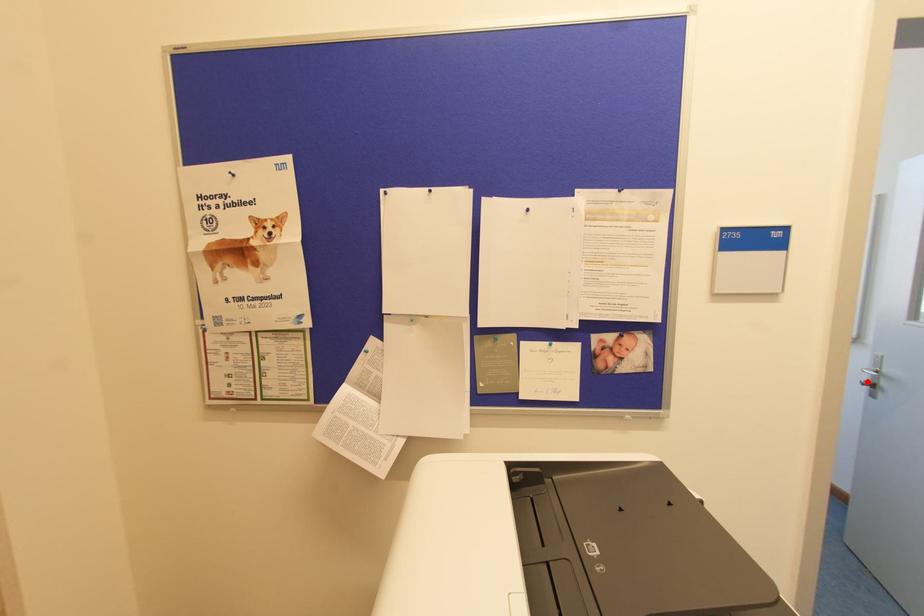
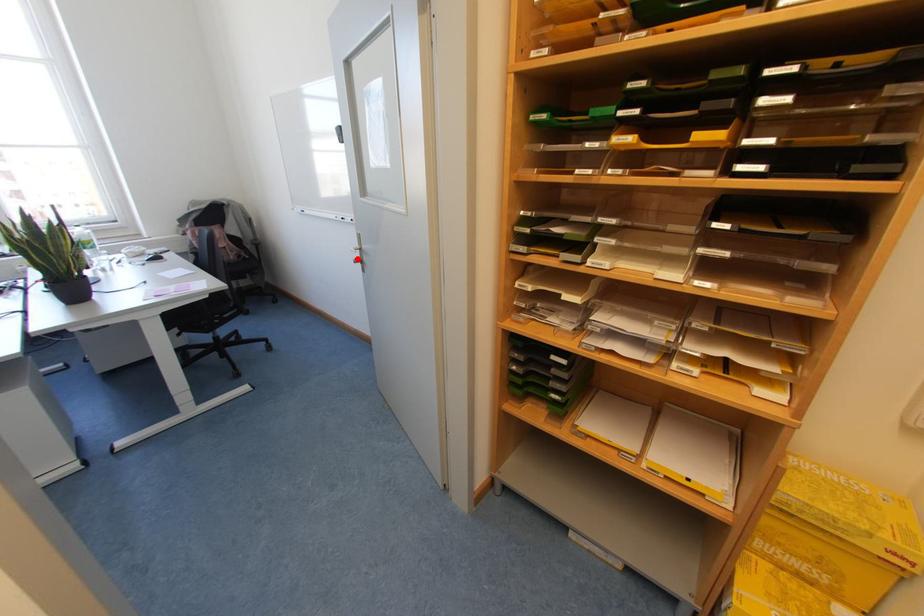
I am providing you with two images of the same scene from different viewpoints. A red point is marked on the first image and another point is marked on the second image. Are the points marked in image1 and image2 representing the same 3D position?

Yes